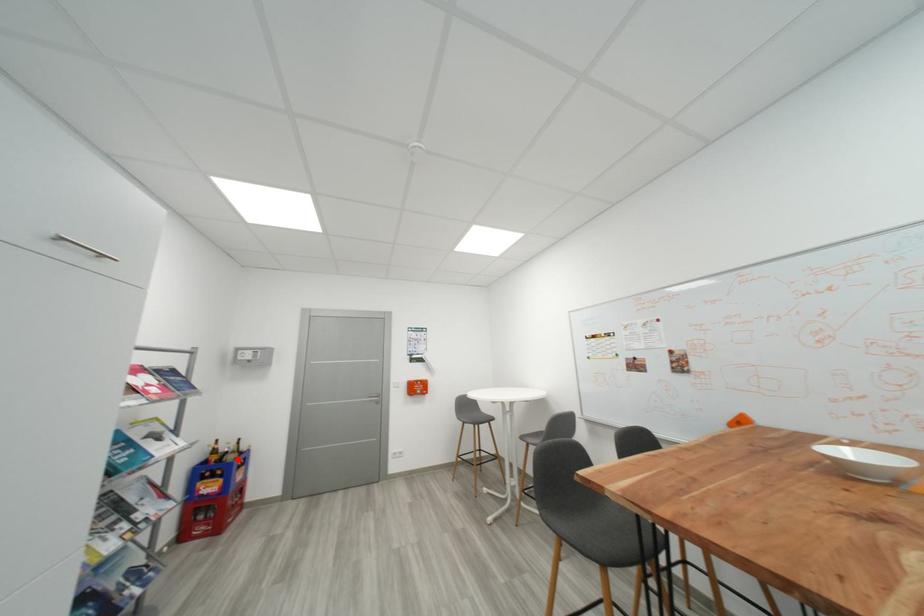
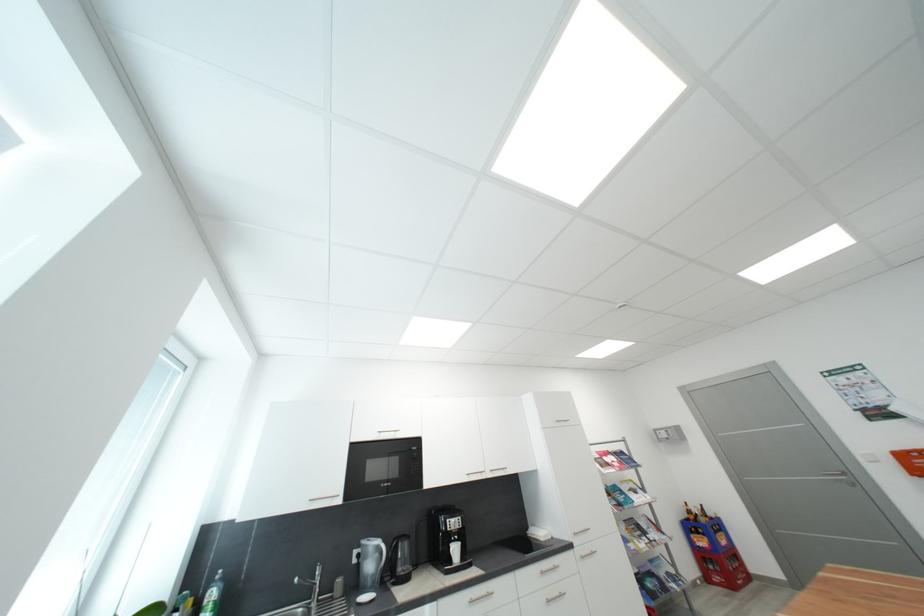
Locate, in the second image, the point that corresponds to the highlighted location in the first image.

(710, 522)